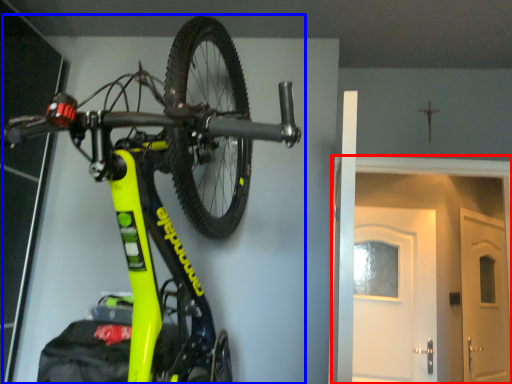
Question: Which point is further to the camera, door (highlighted by a red box) or bicycle (highlighted by a blue box)?

Choices:
 (A) door
 (B) bicycle

Answer: (A)